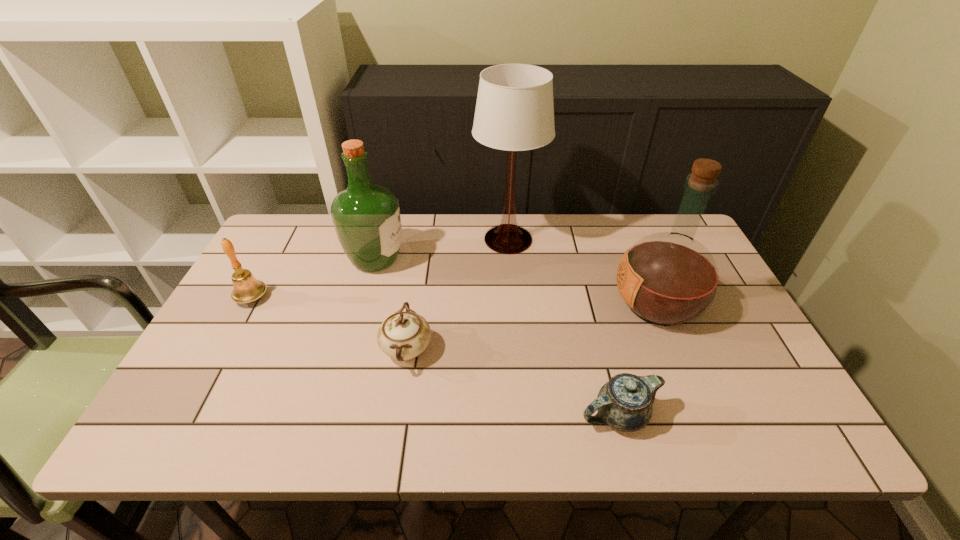
Where is `table lamp`? The width and height of the screenshot is (960, 540). table lamp is located at coordinates (514, 111).

I want to click on the third object from right to left, so coord(514,111).

Where is `the right liquor`? the right liquor is located at coordinates (668, 279).

I want to click on the left liquor, so click(366, 217).

The height and width of the screenshot is (540, 960). I want to click on the fourth tallest object, so click(246, 289).

Where is `bell`? bell is located at coordinates (246, 289).

Locate an element on the screen. This screenshot has height=540, width=960. the left chinaware is located at coordinates (403, 336).

The height and width of the screenshot is (540, 960). In order to click on the nearest object in this screenshot , I will do `click(625, 402)`.

Find the location of a particular element. The image size is (960, 540). the nearer chinaware is located at coordinates (625, 402).

Where is `free space located 0.360m above the cylindrical shade of the table lamp`? free space located 0.360m above the cylindrical shade of the table lamp is located at coordinates (359, 239).